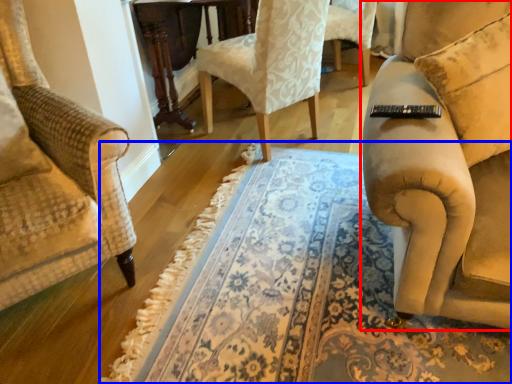
Question: Which object is further to the camera taking this photo, studio couch (highlighted by a red box) or mat (highlighted by a blue box)?

Choices:
 (A) studio couch
 (B) mat

Answer: (A)